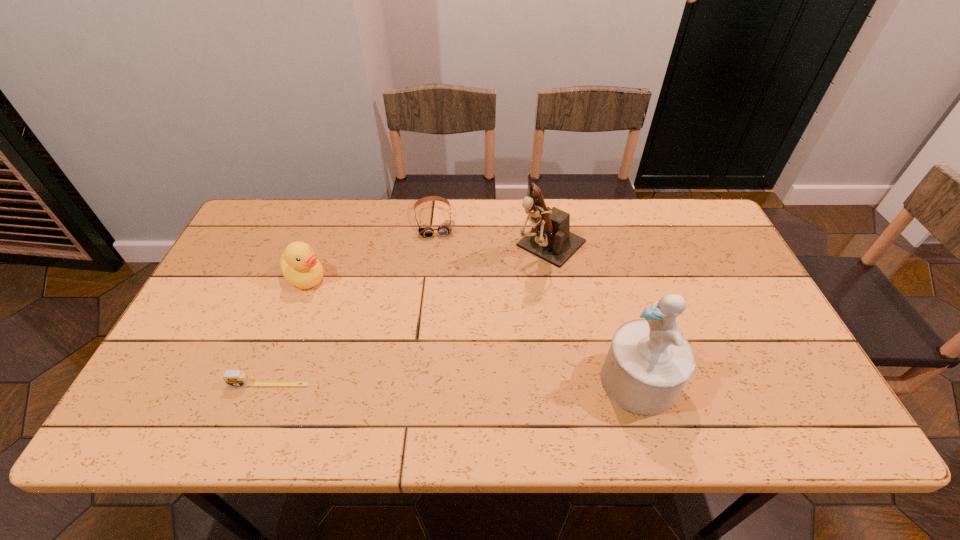
You are a GUI agent. You are given a task and a screenshot of the screen. Output one action in this format:
    pyautogui.click(x=<x>, y=<y>)
    Task: Click on the figurine that is at the near edge
    
    Given the screenshot: What is the action you would take?
    pyautogui.click(x=648, y=363)

Identify the location of free space at the far edge of the desktop. (611, 198).

Where is `free region at the near edge of the desktop`? The height and width of the screenshot is (540, 960). free region at the near edge of the desktop is located at coordinates (589, 376).

What are the coordinates of `vacant space at the left edge` in the screenshot? It's located at (259, 259).

The height and width of the screenshot is (540, 960). In the image, there is a desktop. In order to click on vacant space at the right edge in this screenshot , I will do `click(729, 256)`.

Locate an element on the screen. free spot at the far left corner of the desktop is located at coordinates [268, 224].

Identify the location of free space at the near left corner of the desktop. Image resolution: width=960 pixels, height=540 pixels. (200, 365).

The width and height of the screenshot is (960, 540). Find the location of `vacant space at the near right corner of the desktop`. vacant space at the near right corner of the desktop is located at coordinates (773, 397).

The height and width of the screenshot is (540, 960). What are the coordinates of `vacant space that is in between the farther figurine and the third tallest object` in the screenshot? It's located at (428, 261).

Find the location of `blank region between the duck and the third object from left to right`. blank region between the duck and the third object from left to right is located at coordinates (371, 249).